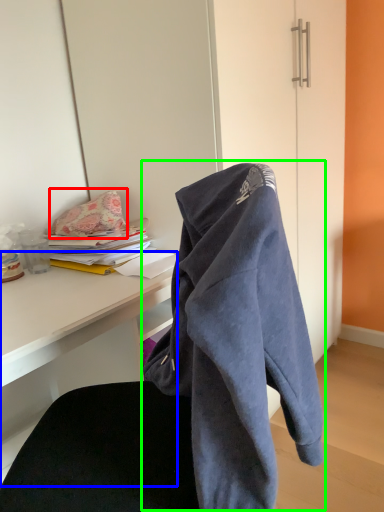
Question: Considering the real-world distances, which object is farthest from pillow (highlighted by a red box)? desk (highlighted by a blue box) or bath towel (highlighted by a green box)?

Choices:
 (A) desk
 (B) bath towel

Answer: (B)